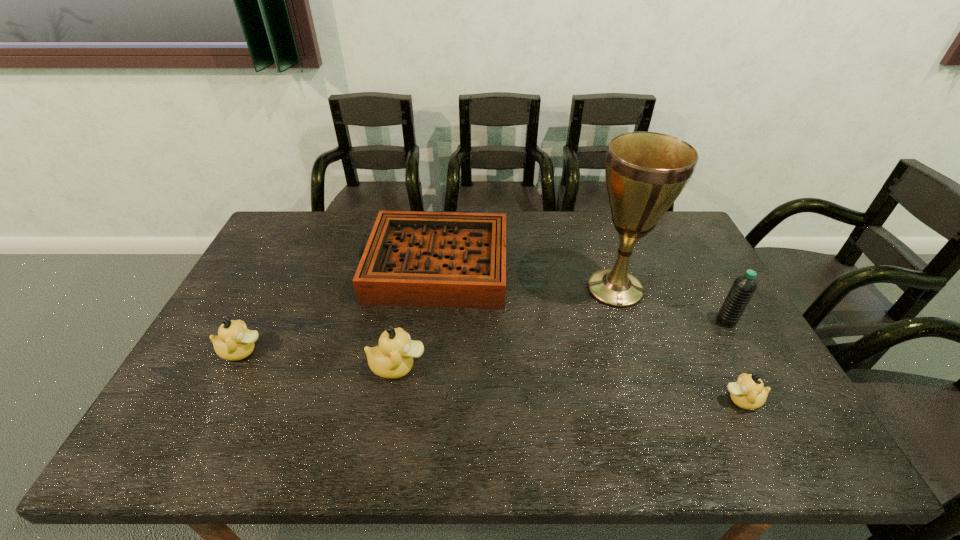
At what (x,y) coordinates should I click in order to perform the action: click on object that is positioned at the near edge. Please return your answer as a coordinate pair (x, y). Looking at the image, I should click on (748, 392).

Image resolution: width=960 pixels, height=540 pixels. What are the coordinates of `object present at the left edge` in the screenshot? It's located at (234, 342).

At what (x,y) coordinates should I click in order to perform the action: click on duckling located at the right edge. Please return your answer as a coordinate pair (x, y). The height and width of the screenshot is (540, 960). Looking at the image, I should click on (748, 392).

You are a GUI agent. You are given a task and a screenshot of the screen. Output one action in this format:
    pyautogui.click(x=<x>, y=<y>)
    Task: Click on the water bottle that is at the right edge
    The image size is (960, 540).
    Given the screenshot: What is the action you would take?
    pyautogui.click(x=743, y=288)

Where is `object that is at the near right corner`? Image resolution: width=960 pixels, height=540 pixels. object that is at the near right corner is located at coordinates (748, 392).

Locate an element on the screen. vacant space at the far edge is located at coordinates (536, 232).

Identify the location of vacant space at the near edge. (378, 394).

Locate an element on the screen. This screenshot has width=960, height=540. vacant area at the left edge is located at coordinates (286, 269).

Where is `vacant space at the right edge of the desktop`? vacant space at the right edge of the desktop is located at coordinates (720, 366).

This screenshot has height=540, width=960. In the image, there is a desktop. In order to click on free space at the far left corner in this screenshot , I will do `click(295, 244)`.